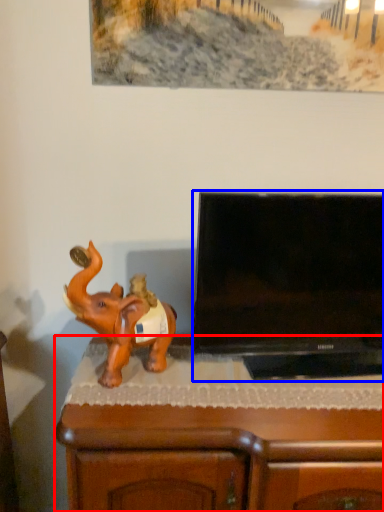
Question: Among these objects, which one is farthest to the camera, furniture (highlighted by a red box) or television (highlighted by a blue box)?

Choices:
 (A) furniture
 (B) television

Answer: (A)